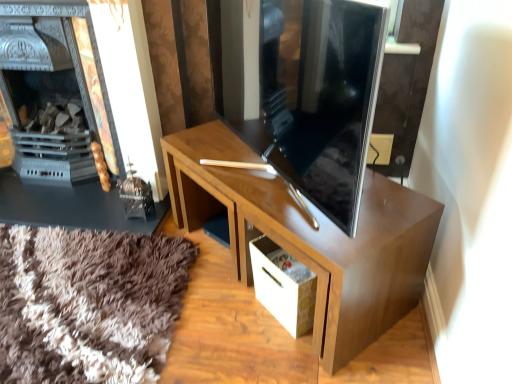
The image size is (512, 384). I want to click on empty space that is in between glossy wood desk at center and white cardboard drawer at lower center, so click(x=233, y=289).